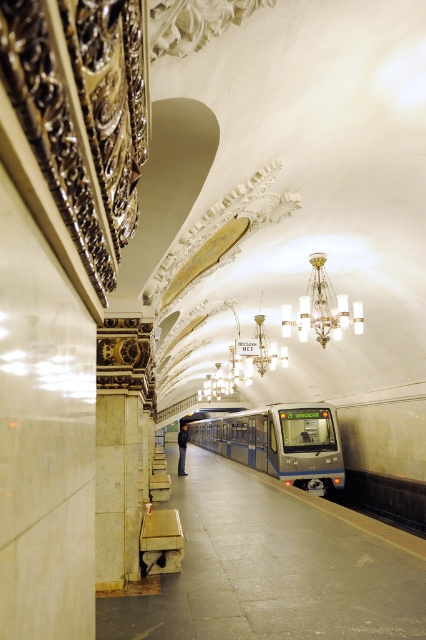
Does blue metallic train at center have a greater height compared to clear glass chandelier at upper center?

Yes, blue metallic train at center is taller than clear glass chandelier at upper center.

Does blue metallic train at center have a smaller size compared to clear glass chandelier at upper center?

Incorrect, blue metallic train at center is not smaller in size than clear glass chandelier at upper center.

Find the location of a particular element. This screenshot has height=640, width=426. blue metallic train at center is located at coordinates (279, 442).